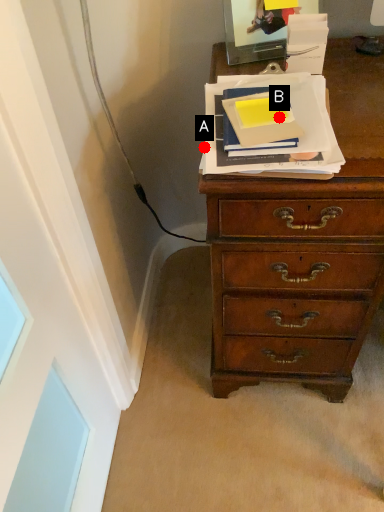
Question: Two points are circled on the image, labeled by A and B beside each circle. Which point is closer to the camera?

Choices:
 (A) A is closer
 (B) B is closer

Answer: (B)